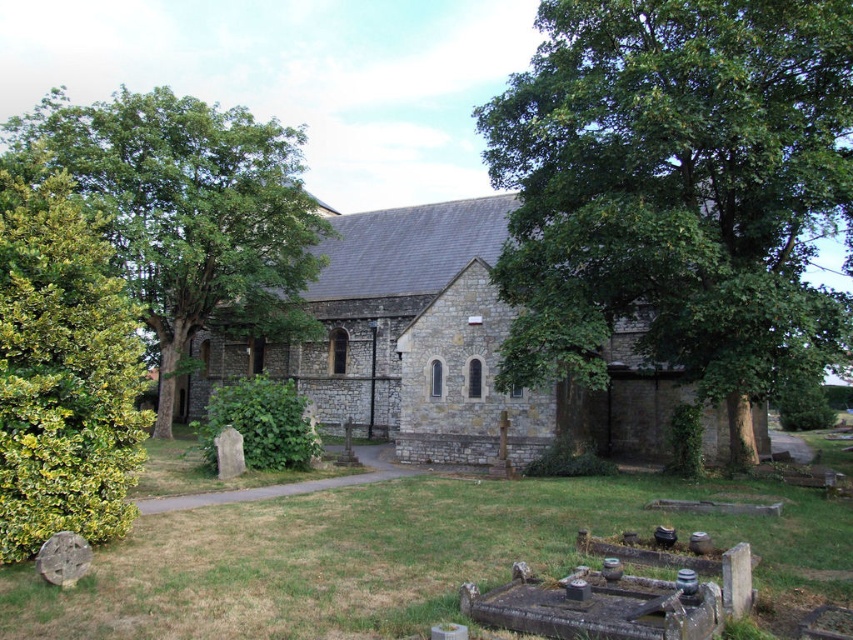
Question: Can you confirm if green leafy tree at center is wider than green leafy bush at left?

Choices:
 (A) yes
 (B) no

Answer: (B)

Question: Is green leafy tree at center further to the viewer compared to green leafy bush at left?

Choices:
 (A) yes
 (B) no

Answer: (A)

Question: Which of the following is the farthest from the observer?

Choices:
 (A) green leafy tree at center
 (B) green leafy bush at left
 (C) green leafy tree at left

Answer: (C)

Question: Which object is farther from the camera taking this photo?

Choices:
 (A) green leafy tree at left
 (B) green leafy bush at left
 (C) gray stone church at center
 (D) green leafy tree at center

Answer: (A)

Question: Which point appears farthest from the camera in this image?

Choices:
 (A) (28, 317)
 (B) (581, 198)
 (C) (437, 349)
 (D) (233, 150)

Answer: (D)

Question: Is green leafy tree at center below green leafy tree at left?

Choices:
 (A) yes
 (B) no

Answer: (A)